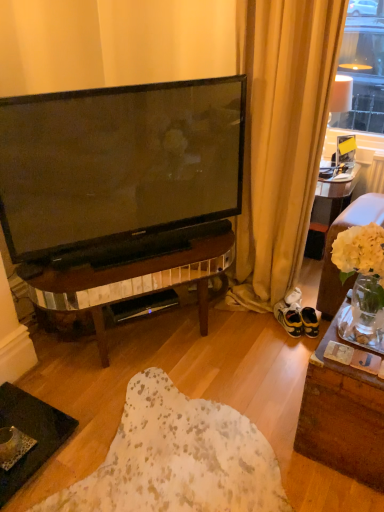
Question: Can you confirm if suede brown couch at right is wider than beige fabric curtain at upper right?

Choices:
 (A) yes
 (B) no

Answer: (A)

Question: Is suede brown couch at right smaller than beige fabric curtain at upper right?

Choices:
 (A) no
 (B) yes

Answer: (B)

Question: Considering the relative positions of suede brown couch at right and beige fabric curtain at upper right in the image provided, is suede brown couch at right behind beige fabric curtain at upper right?

Choices:
 (A) yes
 (B) no

Answer: (B)

Question: Does suede brown couch at right have a greater height compared to beige fabric curtain at upper right?

Choices:
 (A) yes
 (B) no

Answer: (B)

Question: Can you confirm if suede brown couch at right is shorter than beige fabric curtain at upper right?

Choices:
 (A) no
 (B) yes

Answer: (B)

Question: Is suede brown couch at right positioned beyond the bounds of beige fabric curtain at upper right?

Choices:
 (A) yes
 (B) no

Answer: (A)

Question: Is yellow suede sneakers at lower right looking in the opposite direction of suede brown couch at right?

Choices:
 (A) no
 (B) yes

Answer: (A)

Question: Would you consider yellow suede sneakers at lower right to be distant from suede brown couch at right?

Choices:
 (A) no
 (B) yes

Answer: (A)

Question: From the image's perspective, is yellow suede sneakers at lower right over suede brown couch at right?

Choices:
 (A) yes
 (B) no

Answer: (B)

Question: Is yellow suede sneakers at lower right touching suede brown couch at right?

Choices:
 (A) yes
 (B) no

Answer: (B)

Question: Is yellow suede sneakers at lower right outside of suede brown couch at right?

Choices:
 (A) no
 (B) yes

Answer: (B)

Question: Can you confirm if yellow suede sneakers at lower right is taller than suede brown couch at right?

Choices:
 (A) no
 (B) yes

Answer: (A)

Question: Does black plastic speaker at center have a smaller size compared to suede brown couch at right?

Choices:
 (A) no
 (B) yes

Answer: (B)